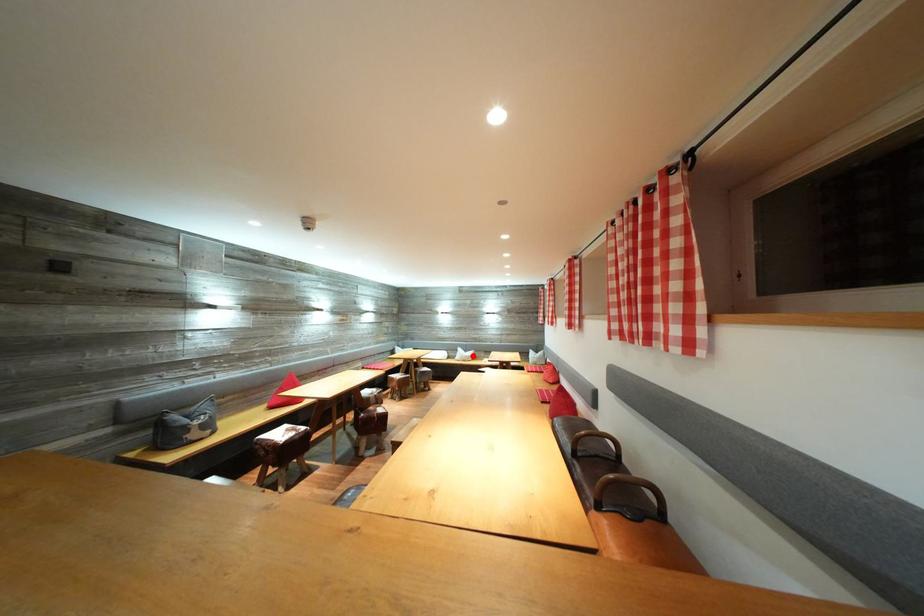
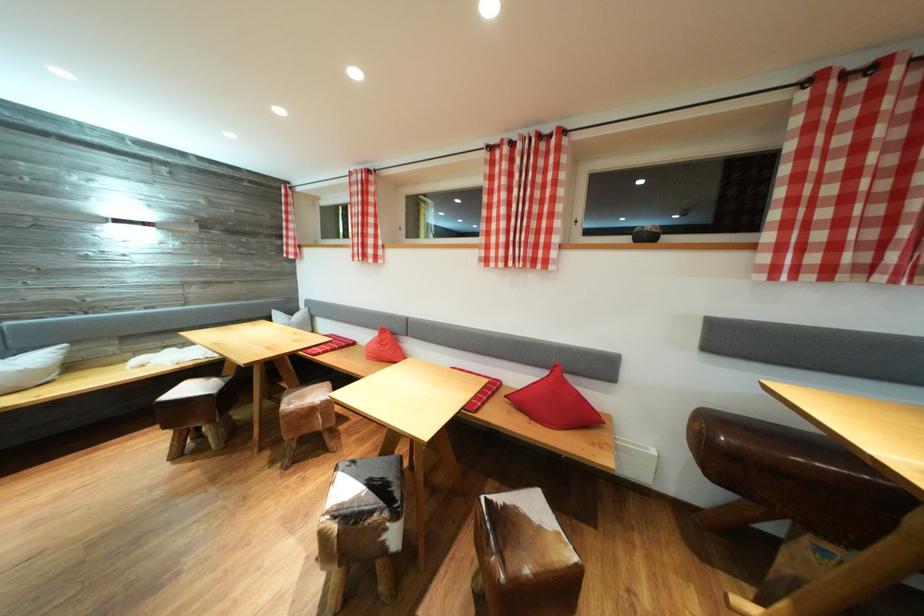
Question: I am providing you with two images of the same scene from different viewpoints. Image1 has a red point marked. In image2, the corresponding 3D location appears at what relative position? Reply with the corresponding letter.

Choices:
 (A) Closer
 (B) Farther

Answer: (A)